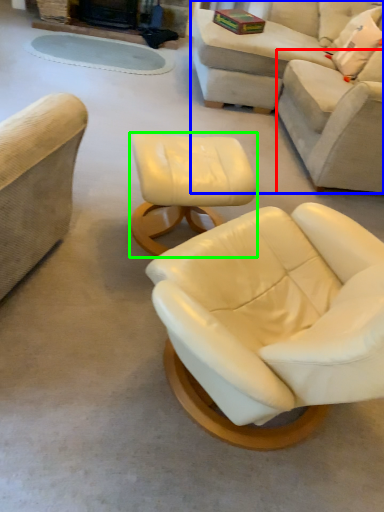
Question: Which object is the closest to the couch (highlighted by a red box)? Choose among these: studio couch (highlighted by a blue box) or table (highlighted by a green box).

Choices:
 (A) studio couch
 (B) table

Answer: (A)